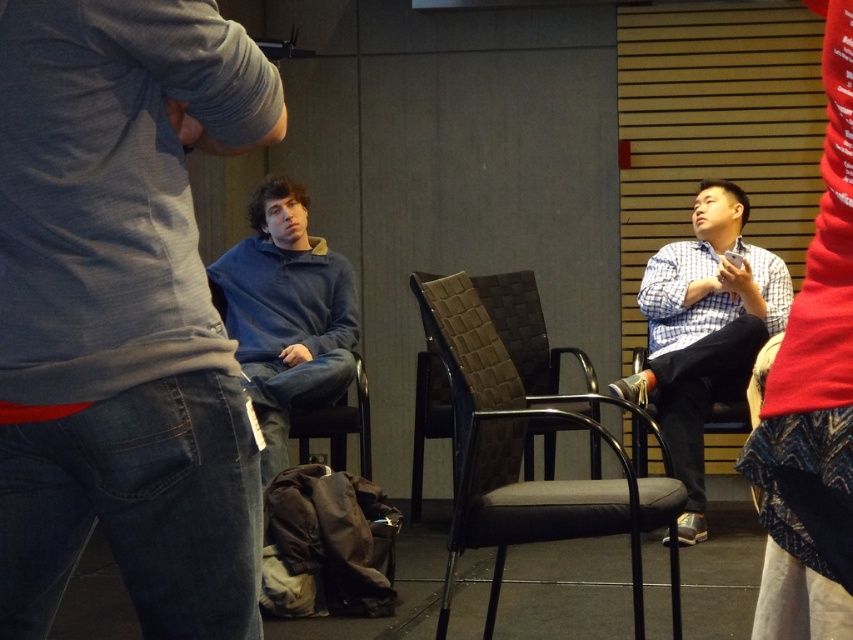
You are a delivery person who needs to place a small package between the blue cotton sweater at center and the blue fleece at center. Can you fit the package in the space between them if the package requires at least 2 meters of space?

The blue cotton sweater at center and blue fleece at center are 3.11 meters apart, so yes, the package requiring at least 2 meters of space can fit between them since the distance is sufficient.

What is the color pattern of the clothing item located at the coordinates point (x=704, y=332)?

The checkered fabric shirt at right is located at point (x=704, y=332).

You are organizing a charity event and need to know if the blue cotton sweater at center can be removed without disturbing the black woven fabric chair at center. Based on their arrangement, is this possible?

The blue cotton sweater at center is positioned over the black woven fabric chair at center, so it can be carefully removed without disturbing the chair itself.